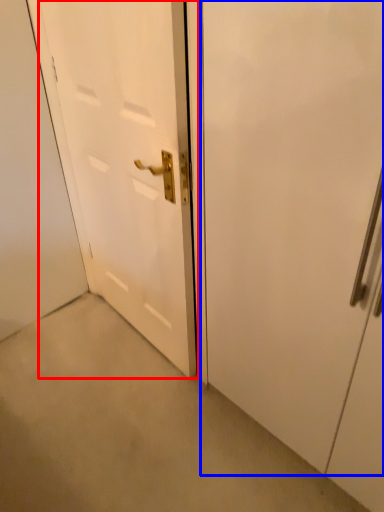
Question: Which of the following is the farthest to the observer, door (highlighted by a red box) or door (highlighted by a blue box)?

Choices:
 (A) door
 (B) door

Answer: (A)